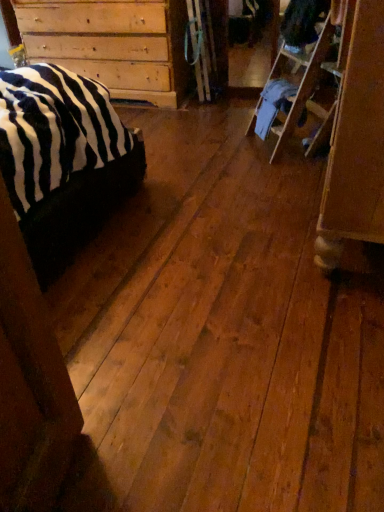
Identify the location of black plush bed at left. The image size is (384, 512). (62, 157).

The width and height of the screenshot is (384, 512). What do you see at coordinates (62, 157) in the screenshot?
I see `black plush bed at left` at bounding box center [62, 157].

Where is `black plush bed at left`? This screenshot has width=384, height=512. black plush bed at left is located at coordinates (62, 157).